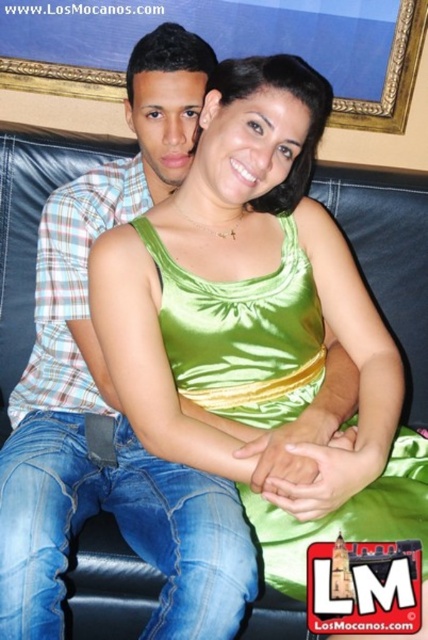
Does green satin tank top at center appear on the left side of gold-framed picture at upper center?

Yes, green satin tank top at center is to the left of gold-framed picture at upper center.

Can you confirm if green satin tank top at center is smaller than gold-framed picture at upper center?

Incorrect, green satin tank top at center is not smaller in size than gold-framed picture at upper center.

This screenshot has width=428, height=640. Find the location of `green satin tank top at center`. green satin tank top at center is located at coordinates (243, 333).